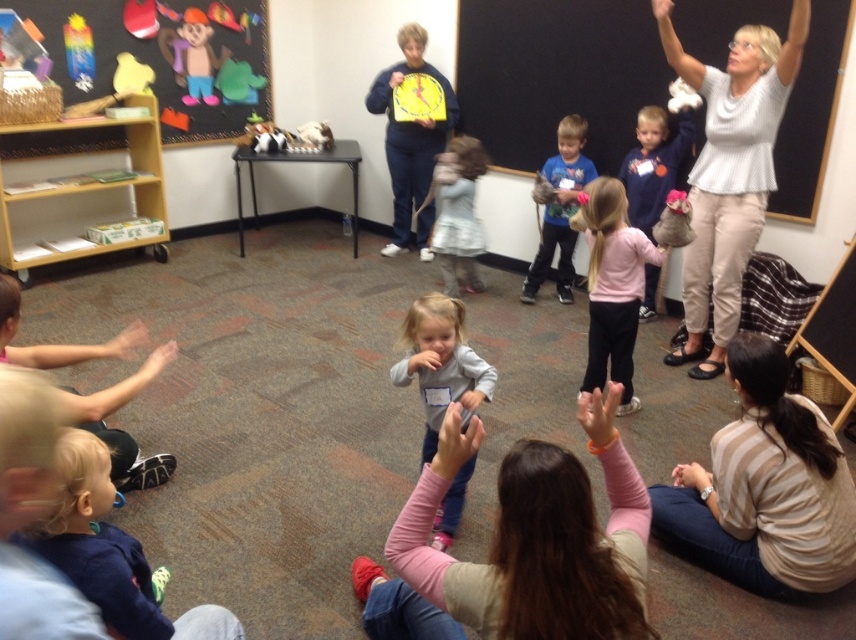
Question: Which of the following is the farthest from the observer?

Choices:
 (A) (84, 422)
 (B) (55, 502)
 (C) (532, 28)

Answer: (C)

Question: Is matte cardboard shelf at upper left smaller than pink matte shirt at center?

Choices:
 (A) yes
 (B) no

Answer: (B)

Question: Is blackboard at upper right above pink fleece jacket at center?

Choices:
 (A) no
 (B) yes

Answer: (B)

Question: Estimate the real-world distances between objects in this image. Which object is farther from the matte cardboard shelf at upper left?

Choices:
 (A) white textured blouse at upper right
 (B) light gray dress at center
 (C) light brown hair at lower left
 (D) pink fabric shirt at center

Answer: (D)

Question: Estimate the real-world distances between objects in this image. Which object is farther from the light brown hair at lower left?

Choices:
 (A) dark blue fabric at lower left
 (B) light gray dress at center
 (C) pink matte shirt at center
 (D) blue cotton shirt at center

Answer: (D)

Question: Can you confirm if white textured blouse at upper right is bigger than gray fleece sweatshirt at center?

Choices:
 (A) yes
 (B) no

Answer: (A)